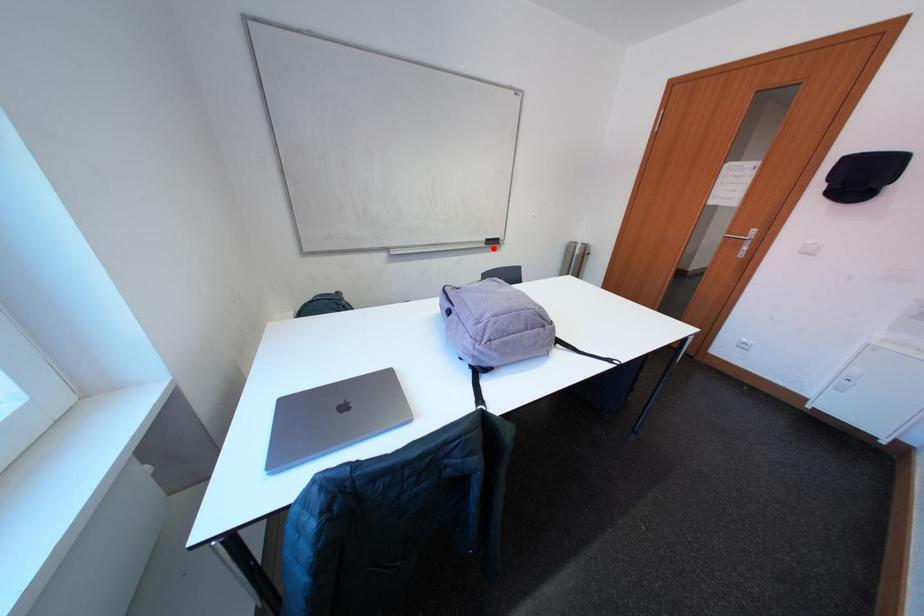
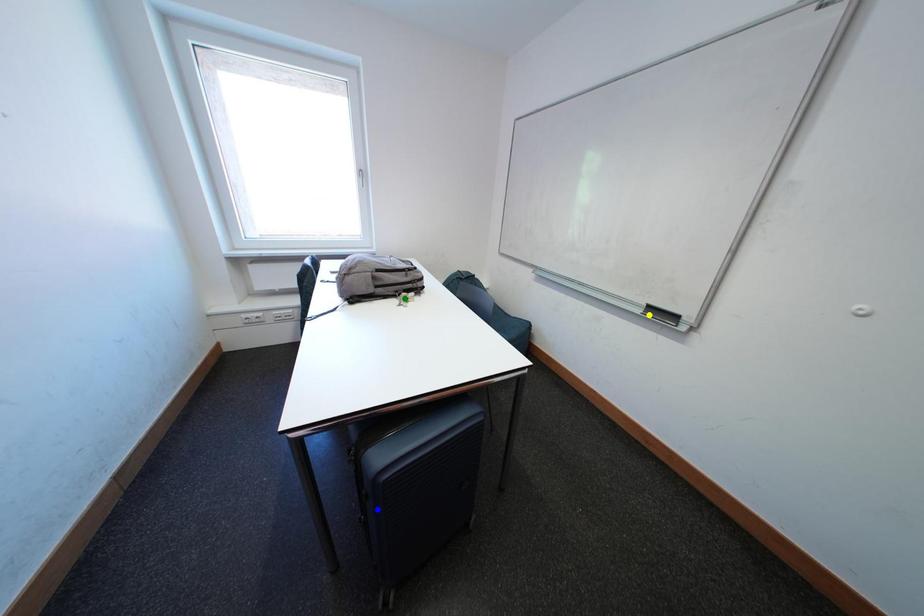
Question: I am providing you with two images of the same scene from different viewpoints. A red point is marked on the first image. You are given multiple points on the second image. Which point in image 2 represents the same 3d spot as the red point in image 1?

Choices:
 (A) yellow point
 (B) green point
 (C) blue point

Answer: (A)